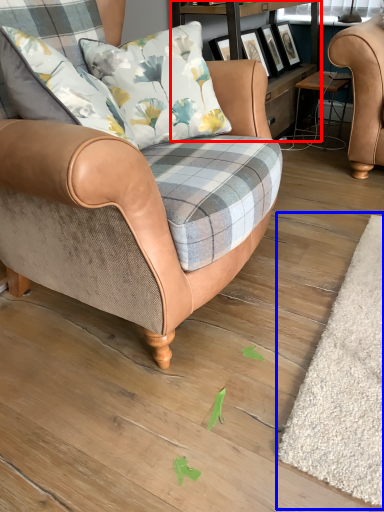
Question: Among these objects, which one is nearest to the camera, shelf (highlighted by a red box) or mat (highlighted by a blue box)?

Choices:
 (A) shelf
 (B) mat

Answer: (B)